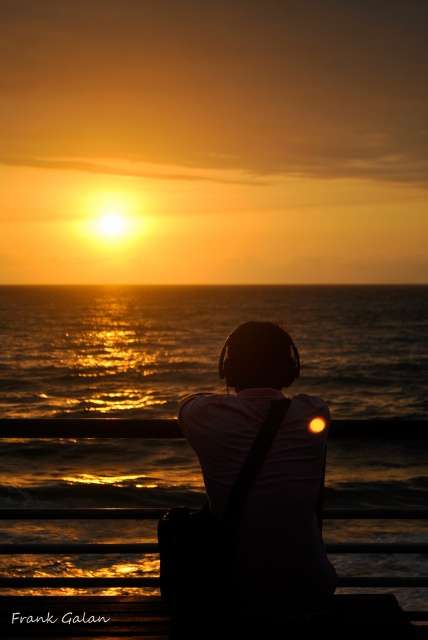
Question: Is the position of shiny golden water at center less distant than that of black matte headphones at center?

Choices:
 (A) no
 (B) yes

Answer: (A)

Question: Which of the following is the closest to the observer?

Choices:
 (A) black matte headphones at center
 (B) shiny golden water at center

Answer: (A)

Question: Can you confirm if shiny golden water at center is smaller than black matte headphones at center?

Choices:
 (A) yes
 (B) no

Answer: (B)

Question: Among these points, which one is farthest from the camera?

Choices:
 (A) (315, 435)
 (B) (50, 289)

Answer: (B)

Question: Is shiny golden water at center to the left of black matte headphones at center from the viewer's perspective?

Choices:
 (A) yes
 (B) no

Answer: (A)